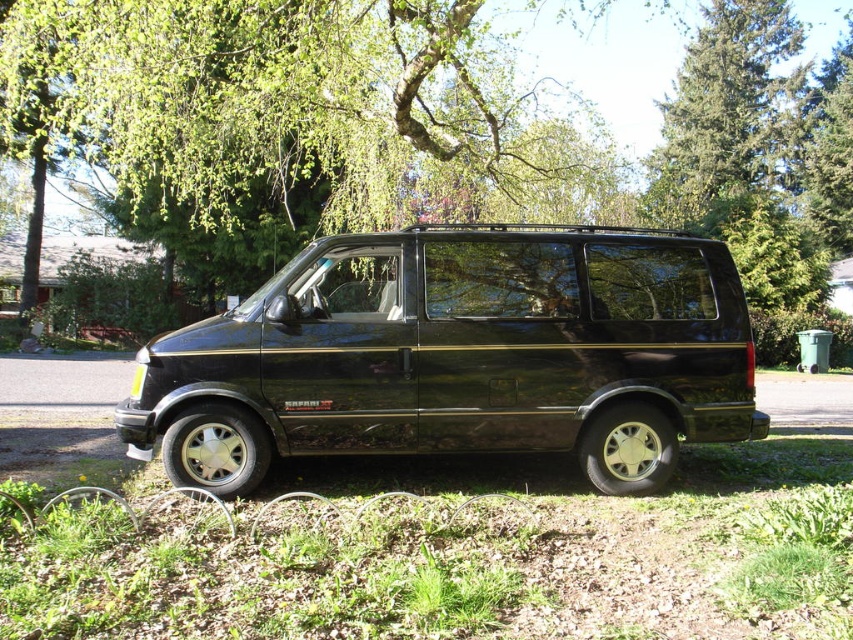
Question: Which is nearer to the green needle-like leaves at upper center?

Choices:
 (A) green leafy tree at upper center
 (B) green grass at lower center
 (C) black glossy minivan at center

Answer: (A)

Question: Can you confirm if green leafy tree at upper center is thinner than green needle-like leaves at upper center?

Choices:
 (A) no
 (B) yes

Answer: (A)

Question: Is green leafy tree at upper center behind green grass at lower center?

Choices:
 (A) yes
 (B) no

Answer: (A)

Question: Which point is closer to the camera?

Choices:
 (A) black glossy minivan at center
 (B) green needle-like leaves at upper center
 (C) green grass at lower center
 (D) green leafy tree at upper center

Answer: (C)

Question: Does black glossy minivan at center appear on the right side of green needle-like leaves at upper center?

Choices:
 (A) no
 (B) yes

Answer: (A)

Question: Which of the following is the farthest from the observer?

Choices:
 (A) (738, 49)
 (B) (770, 605)

Answer: (A)